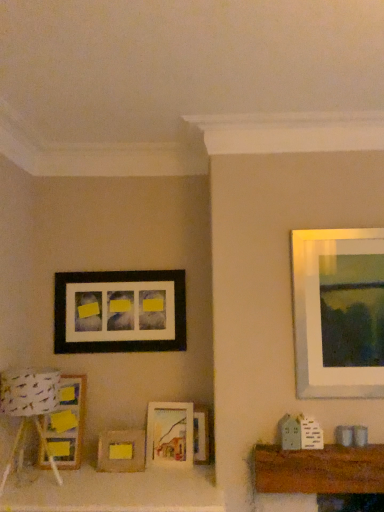
The height and width of the screenshot is (512, 384). Identify the location of empty space that is ontop of matte black picture frame at upper left, placed as the 5th picture frame when sorted from bottom to top (from a real-world perspective). (122, 266).